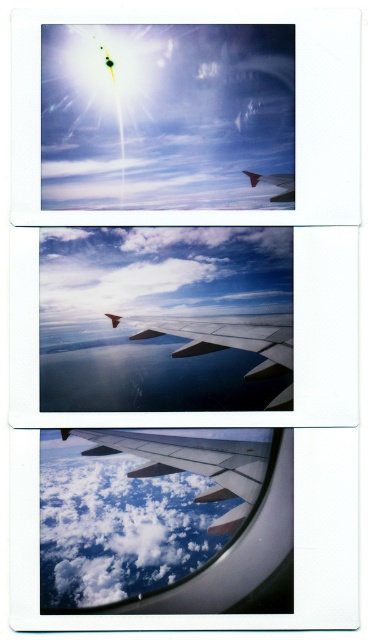
Question: Considering the real-world distances, which object is closest to the metallic silver wing at center?

Choices:
 (A) matte metallic wing at center
 (B) cloudy white cloud at center
 (C) matte red wing at center

Answer: (A)

Question: In this image, where is metallic silver wing at center located relative to matte red wing at center?

Choices:
 (A) above
 (B) below

Answer: (B)

Question: Which of the following is the farthest from the observer?

Choices:
 (A) (282, 180)
 (B) (101, 580)
 (C) (235, 477)
 (D) (274, 316)

Answer: (D)

Question: Estimate the real-world distances between objects in this image. Which object is closer to the matte red wing at center?

Choices:
 (A) cloudy white cloud at center
 (B) matte metallic wing at center

Answer: (B)

Question: Is matte metallic wing at center smaller than metallic silver wing at center?

Choices:
 (A) no
 (B) yes

Answer: (A)

Question: Does cloudy white cloud at center appear on the right side of matte metallic wing at center?

Choices:
 (A) no
 (B) yes

Answer: (A)